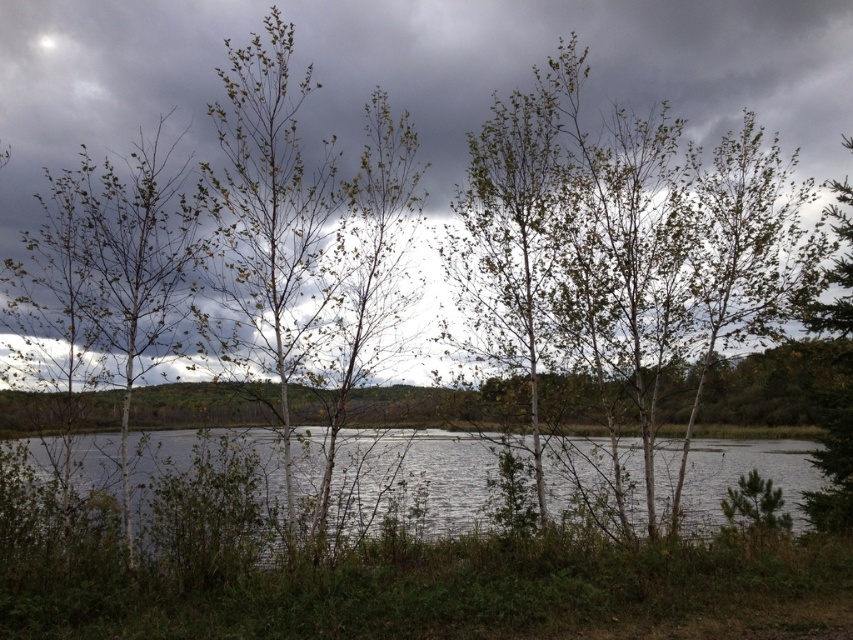
Question: Does gray cloudy sky at upper center appear over clear water at center?

Choices:
 (A) no
 (B) yes

Answer: (B)

Question: Does gray cloudy sky at upper center lie in front of clear water at center?

Choices:
 (A) no
 (B) yes

Answer: (B)

Question: Which of the following is the closest to the observer?

Choices:
 (A) gray cloudy sky at upper center
 (B) clear water at center

Answer: (A)

Question: Which point is farther from the camera taking this photo?

Choices:
 (A) (795, 445)
 (B) (820, 93)

Answer: (A)

Question: Can you confirm if gray cloudy sky at upper center is positioned above clear water at center?

Choices:
 (A) yes
 (B) no

Answer: (A)